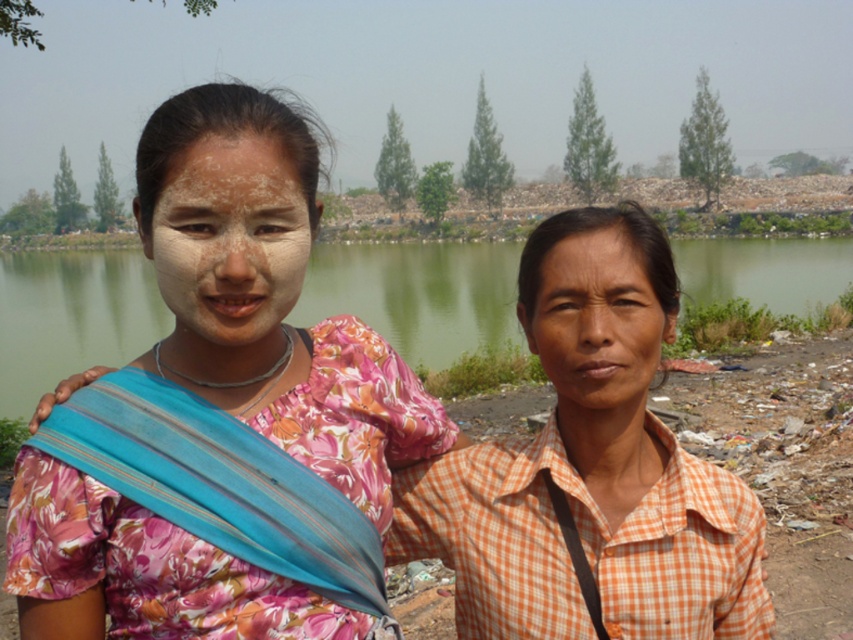
Is orange checkered shirt at right above green water at center?

Actually, orange checkered shirt at right is below green water at center.

Which is more to the left, orange checkered shirt at right or green water at center?

From the viewer's perspective, green water at center appears more on the left side.

Find the location of `orange checkered shirt at right`. orange checkered shirt at right is located at coordinates (590, 467).

Is orange checkered shirt at right taller than smooth skin face at center?

Indeed, orange checkered shirt at right has a greater height compared to smooth skin face at center.

Which is more to the right, orange checkered shirt at right or smooth skin face at center?

Positioned to the right is orange checkered shirt at right.

What do you see at coordinates (590, 467) in the screenshot? I see `orange checkered shirt at right` at bounding box center [590, 467].

You are a GUI agent. You are given a task and a screenshot of the screen. Output one action in this format:
    pyautogui.click(x=<x>, y=<y>)
    Task: Click on the orange checkered shirt at right
    
    Given the screenshot: What is the action you would take?
    pyautogui.click(x=590, y=467)

What do you see at coordinates (268, 294) in the screenshot? I see `floral fabric dress at center` at bounding box center [268, 294].

Is floral fabric dress at center positioned in front of orange checkered shirt at right?

Yes.

Image resolution: width=853 pixels, height=640 pixels. What do you see at coordinates (268, 294) in the screenshot? I see `floral fabric dress at center` at bounding box center [268, 294].

You are a GUI agent. You are given a task and a screenshot of the screen. Output one action in this format:
    pyautogui.click(x=<x>, y=<y>)
    Task: Click on the floral fabric dress at center
    
    Given the screenshot: What is the action you would take?
    pyautogui.click(x=268, y=294)